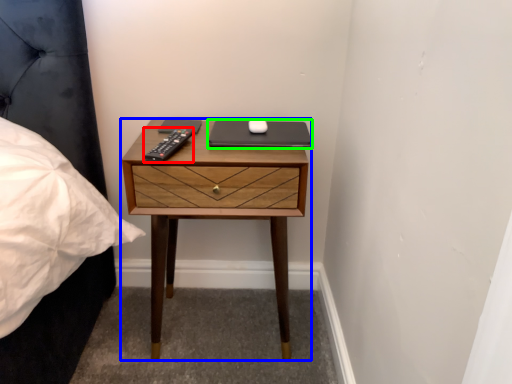
Question: Estimate the real-world distances between objects in this image. Which object is closer to remote (highlighted by a red box), nightstand (highlighted by a blue box) or laptop (highlighted by a green box)?

Choices:
 (A) nightstand
 (B) laptop

Answer: (B)